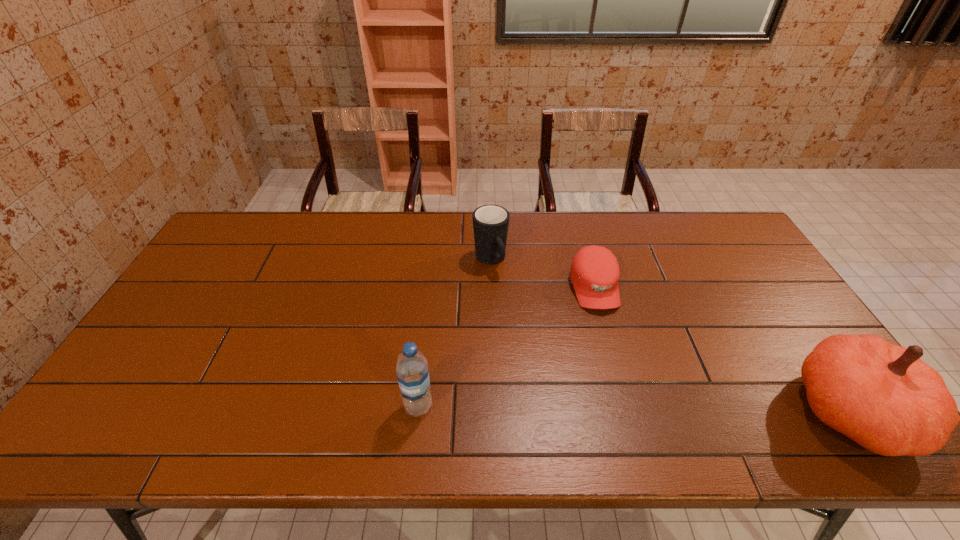
Identify the location of vacant spot on the desktop that is between the leftmost object and the pumpkin and is positioned on the front-facing side of the second object from right to left. This screenshot has width=960, height=540. (632, 409).

Image resolution: width=960 pixels, height=540 pixels. I want to click on free space on the desktop that is between the water bottle and the pumpkin and is positioned on the side of the mug with the handle, so click(x=575, y=408).